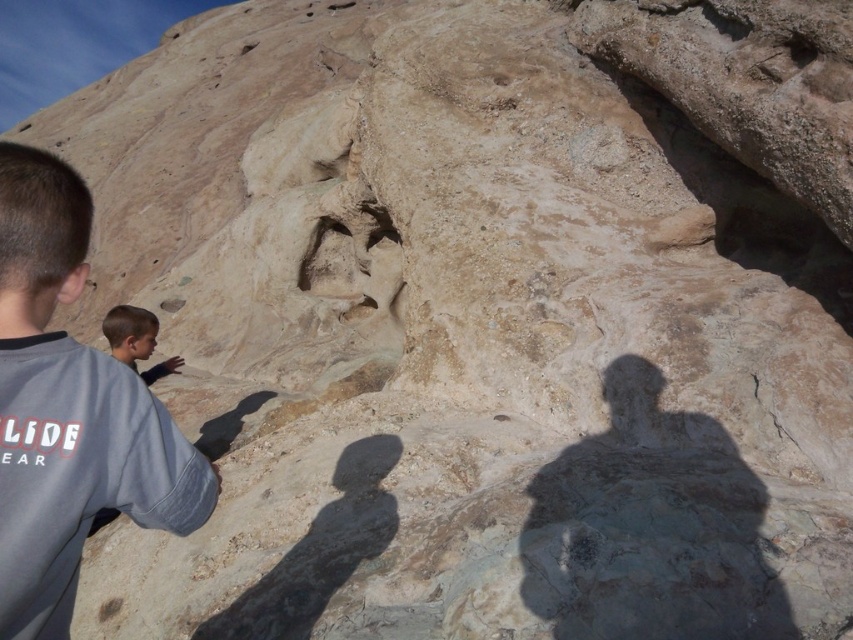
You are standing at the point marked by the coordinates point (68, 410) in the desert scene. Looking around, you see the gray cotton shirt at upper left. Which direction should you face to look towards the gray cotton shirt at upper left?

The gray cotton shirt at upper left is located at the point marked by the coordinates point (68, 410), so you are already facing it.

You are a photographer trying to capture a portrait of the two people in the desert scene. You notice the light brown hair at lower left and the smooth skin face at lower left. Which of these two features is narrower in width?

The light brown hair at lower left has a lesser width compared to the smooth skin face at lower left, so the light brown hair at lower left is narrower in width.